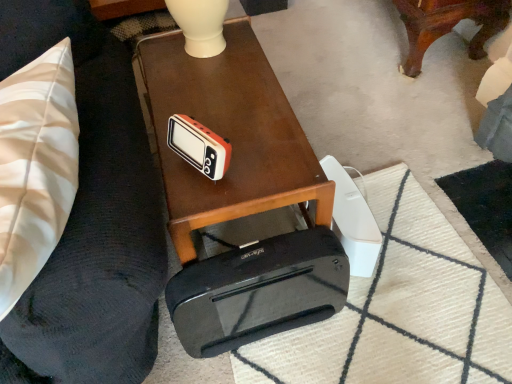
Where is `empty space that is ontop of wooden table at center (from a real-world perspective)`? The image size is (512, 384). empty space that is ontop of wooden table at center (from a real-world perspective) is located at coordinates (221, 100).